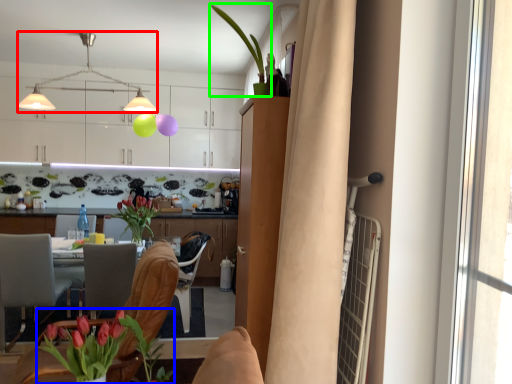
Question: Considering the real-world distances, which object is farthest from lamp (highlighted by a red box)? floral arrangement (highlighted by a blue box) or houseplant (highlighted by a green box)?

Choices:
 (A) floral arrangement
 (B) houseplant

Answer: (A)